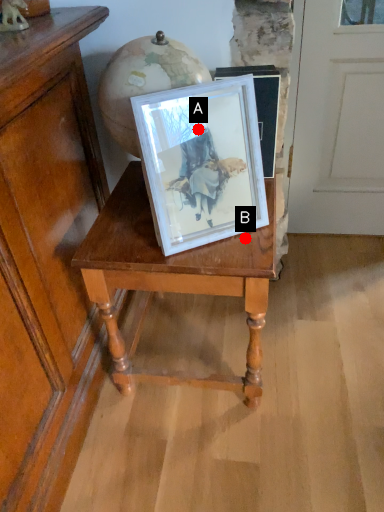
Question: Two points are circled on the image, labeled by A and B beside each circle. Which point appears closest to the camera in this image?

Choices:
 (A) A is closer
 (B) B is closer

Answer: (A)